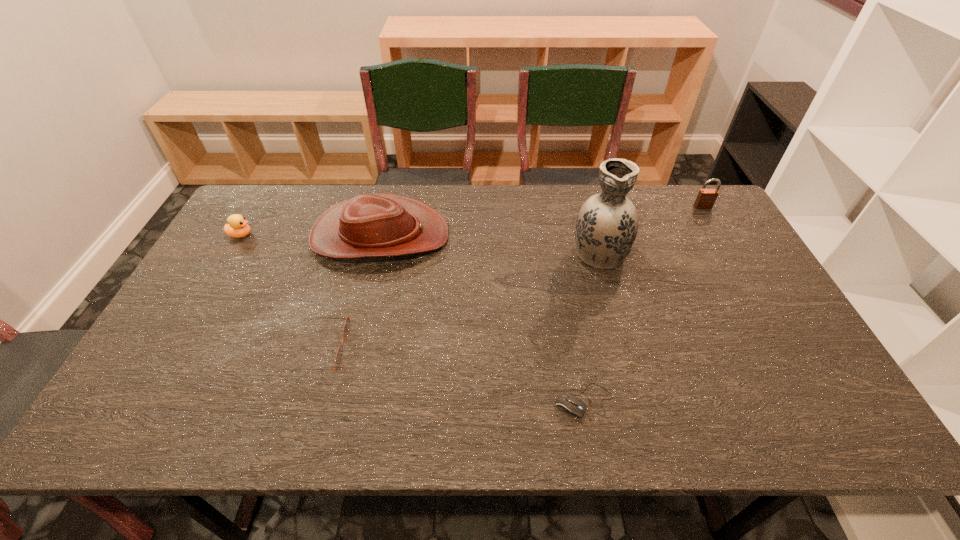
At what (x,y) coordinates should I click in order to perform the action: click on object that is positioned at the left edge. Please return your answer as a coordinate pair (x, y). Looking at the image, I should click on (237, 227).

Locate an element on the screen. object that is at the right edge is located at coordinates (706, 198).

The height and width of the screenshot is (540, 960). I want to click on object present at the far right corner, so click(706, 198).

Image resolution: width=960 pixels, height=540 pixels. In the image, there is a desktop. What are the coordinates of `vacant region at the far edge` in the screenshot? It's located at (502, 211).

You are a GUI agent. You are given a task and a screenshot of the screen. Output one action in this format:
    pyautogui.click(x=<x>, y=<y>)
    Task: Click on the vacant area at the near edge of the desktop
    This screenshot has width=960, height=540.
    Given the screenshot: What is the action you would take?
    pyautogui.click(x=619, y=428)

The image size is (960, 540). What are the coordinates of `vacant area at the right edge` in the screenshot? It's located at click(761, 344).

Identify the location of vacant region at the far left corner of the desktop. The height and width of the screenshot is (540, 960). (247, 217).

You are a GUI agent. You are given a task and a screenshot of the screen. Output one action in this format:
    pyautogui.click(x=<x>, y=<y>)
    Task: Click on the free region at the near right corner
    The image size is (960, 540).
    Given the screenshot: What is the action you would take?
    pyautogui.click(x=847, y=425)

Where is `free point between the sunglasses and the padlock`? This screenshot has width=960, height=540. free point between the sunglasses and the padlock is located at coordinates (513, 278).

At what (x,y) coordinates should I click in order to perform the action: click on blank region between the padlock and the computer mouse. Please return your answer as a coordinate pair (x, y). This screenshot has width=960, height=540. Looking at the image, I should click on (643, 304).